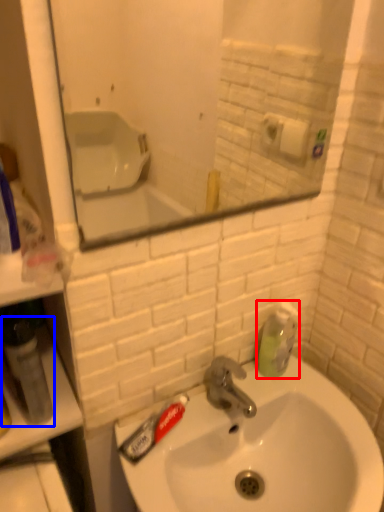
Question: Among these objects, which one is nearest to the camera, soap dispenser (highlighted by a red box) or mouthwash (highlighted by a blue box)?

Choices:
 (A) soap dispenser
 (B) mouthwash

Answer: (B)